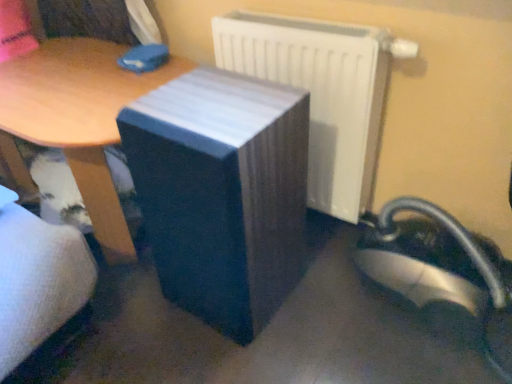
The width and height of the screenshot is (512, 384). Find the location of `spots to the right of matte black speaker at center, which is counted as the 1th table, starting from the right`. spots to the right of matte black speaker at center, which is counted as the 1th table, starting from the right is located at coordinates (323, 300).